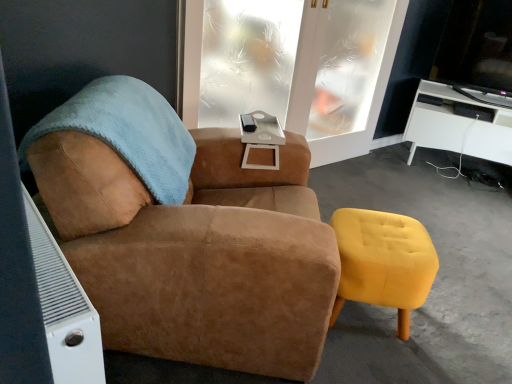
Locate an element on the screen. Image resolution: width=512 pixels, height=384 pixels. suede brown armchair at center is located at coordinates (194, 238).

This screenshot has height=384, width=512. Describe the element at coordinates (460, 123) in the screenshot. I see `white glossy desk at right` at that location.

Locate an element on the screen. yellow velvet stool at lower right is located at coordinates (383, 262).

What do you see at coordinates (247, 58) in the screenshot? The height and width of the screenshot is (384, 512). I see `frosted glass window at center` at bounding box center [247, 58].

Locate an element on the screen. Image resolution: width=512 pixels, height=384 pixels. suede brown armchair at center is located at coordinates (194, 238).

Where is `window behind the white matte side table at center`? window behind the white matte side table at center is located at coordinates (247, 58).

Are frosted glass window at center and white matte side table at center beside each other?

No.

From a real-world perspective, is frosted glass window at center over white matte side table at center?

Yes, from a real-world perspective, frosted glass window at center is over white matte side table at center

Is frosted glass window at center closer to the viewer compared to suede brown armchair at center?

No, it is not.

From a real-world perspective, is frosted glass window at center over suede brown armchair at center?

Indeed, from a real-world perspective, frosted glass window at center stands above suede brown armchair at center.

Considering the positions of objects frosted glass window at center and suede brown armchair at center in the image provided, who is more to the left, frosted glass window at center or suede brown armchair at center?

Positioned to the left is suede brown armchair at center.

Which of these two, frosted glass window at center or suede brown armchair at center, is wider?

suede brown armchair at center is wider.

From a real-world perspective, is white matte side table at center located higher than suede brown armchair at center?

Yes, from a real-world perspective, white matte side table at center is on top of suede brown armchair at center.

Does point (273, 169) appear closer or farther from the camera than point (56, 224)?

Clearly, point (273, 169) is more distant from the camera than point (56, 224).

How different are the orientations of white matte side table at center and suede brown armchair at center in degrees?

white matte side table at center and suede brown armchair at center are facing 3.55 degrees away from each other.

Is the surface of white matte side table at center in direct contact with suede brown armchair at center?

They are not placed beside each other.

From a real-world perspective, does white matte side table at center stand above white glossy desk at right?

Yes.

Based on the photo, is white matte side table at center closer to the viewer compared to white glossy desk at right?

Yes, white matte side table at center is in front of white glossy desk at right.

Can you confirm if white matte side table at center is shorter than white glossy desk at right?

Correct, white matte side table at center is not as tall as white glossy desk at right.

From the image's perspective, between white matte side table at center and white glossy desk at right, who is located below?

white matte side table at center, from the image's perspective.

Based on the photo, considering the sizes of white glossy desk at right and white matte side table at center in the image, is white glossy desk at right taller or shorter than white matte side table at center?

In the image, white glossy desk at right appears to be taller than white matte side table at center.

Looking at the image, does white glossy desk at right seem bigger or smaller compared to white matte side table at center?

Considering their sizes, white glossy desk at right takes up more space than white matte side table at center.

Is white glossy desk at right not inside white matte side table at center?

white glossy desk at right is positioned outside white matte side table at center.

From a real-world perspective, is clear frosted glass door at upper center physically located above or below yellow velvet stool at lower right?

In terms of real-world spatial position, clear frosted glass door at upper center is above yellow velvet stool at lower right.

Is clear frosted glass door at upper center surrounding yellow velvet stool at lower right?

No, yellow velvet stool at lower right is not surrounded by clear frosted glass door at upper center.

Can you see clear frosted glass door at upper center touching yellow velvet stool at lower right?

clear frosted glass door at upper center and yellow velvet stool at lower right are not in contact.

Which is in front, point (344, 143) or point (355, 250)?

The point (355, 250) is in front.

Which object is positioned more to the right, suede brown armchair at center or white glossy desk at right?

Positioned to the right is white glossy desk at right.

Could you tell me if suede brown armchair at center is turned towards white glossy desk at right?

No.

From a real-world perspective, is suede brown armchair at center positioned above or below white glossy desk at right?

suede brown armchair at center is above white glossy desk at right.

Locate an element on the screen. The image size is (512, 384). side table below the frosted glass window at center (from the image's perspective) is located at coordinates (261, 137).

The width and height of the screenshot is (512, 384). What are the coordinates of `chair in front of the frosted glass window at center` in the screenshot? It's located at (194, 238).

Looking at the image, which one is located further to suede brown armchair at center, frosted glass window at center or white matte side table at center?

frosted glass window at center is further to suede brown armchair at center.

Considering their positions, is yellow velvet stool at lower right positioned closer to clear frosted glass door at upper center than frosted glass window at center?

Among the two, frosted glass window at center is located nearer to clear frosted glass door at upper center.

Looking at the image, which one is located further to white glossy desk at right, clear frosted glass door at upper center or frosted glass window at center?

frosted glass window at center is further to white glossy desk at right.

Based on their spatial positions, is white glossy desk at right or suede brown armchair at center further from white matte side table at center?

white glossy desk at right.

Based on their spatial positions, is white glossy desk at right or white matte side table at center closer to suede brown armchair at center?

white matte side table at center lies closer to suede brown armchair at center than the other object.

Estimate the real-world distances between objects in this image. Which object is further from yellow velvet stool at lower right, suede brown armchair at center or clear frosted glass door at upper center?

Among the two, clear frosted glass door at upper center is located further to yellow velvet stool at lower right.

Which object lies further to the anchor point clear frosted glass door at upper center, white matte side table at center or white glossy desk at right?

white matte side table at center is positioned further to the anchor clear frosted glass door at upper center.

Estimate the real-world distances between objects in this image. Which object is further from white glossy desk at right, frosted glass window at center or clear frosted glass door at upper center?

frosted glass window at center is positioned further to the anchor white glossy desk at right.

Find the location of `stool situated between white matte side table at center and white glossy desk at right from left to right`. stool situated between white matte side table at center and white glossy desk at right from left to right is located at coordinates (383, 262).

Image resolution: width=512 pixels, height=384 pixels. In order to click on window between suede brown armchair at center and white glossy desk at right from left to right in this screenshot , I will do `click(247, 58)`.

At what (x,y) coordinates should I click in order to perform the action: click on window between suede brown armchair at center and clear frosted glass door at upper center along the z-axis. Please return your answer as a coordinate pair (x, y). Looking at the image, I should click on (247, 58).

Identify the location of screen door between suede brown armchair at center and white glossy desk at right along the z-axis. The width and height of the screenshot is (512, 384). (293, 67).